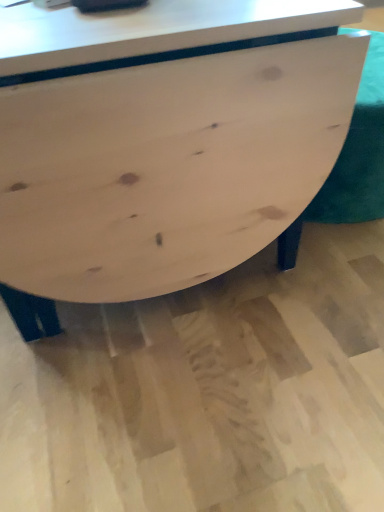
Question: Should I look upward or downward to see natural wood swivel chair at center?

Choices:
 (A) up
 (B) down

Answer: (A)

Question: Is natural wood swivel chair at center in contact with natural wood table at center?

Choices:
 (A) yes
 (B) no

Answer: (B)

Question: Is the depth of natural wood swivel chair at center greater than that of natural wood table at center?

Choices:
 (A) no
 (B) yes

Answer: (B)

Question: Is natural wood table at center at the back of natural wood swivel chair at center?

Choices:
 (A) yes
 (B) no

Answer: (B)

Question: Does natural wood swivel chair at center have a greater height compared to natural wood table at center?

Choices:
 (A) yes
 (B) no

Answer: (B)

Question: From a real-world perspective, is natural wood swivel chair at center positioned over natural wood table at center based on gravity?

Choices:
 (A) no
 (B) yes

Answer: (A)

Question: Considering the relative sizes of natural wood swivel chair at center and natural wood table at center in the image provided, is natural wood swivel chair at center thinner than natural wood table at center?

Choices:
 (A) no
 (B) yes

Answer: (B)

Question: Is natural wood table at center looking in the opposite direction of natural wood swivel chair at center?

Choices:
 (A) no
 (B) yes

Answer: (A)

Question: Could you tell me if natural wood table at center is turned towards natural wood swivel chair at center?

Choices:
 (A) no
 (B) yes

Answer: (A)

Question: From a real-world perspective, is natural wood table at center on natural wood swivel chair at center?

Choices:
 (A) no
 (B) yes

Answer: (B)

Question: Could natural wood swivel chair at center be considered to be inside natural wood table at center?

Choices:
 (A) yes
 (B) no

Answer: (B)

Question: Is natural wood table at center not inside natural wood swivel chair at center?

Choices:
 (A) no
 (B) yes

Answer: (B)

Question: Is natural wood table at center further to the viewer compared to natural wood swivel chair at center?

Choices:
 (A) no
 (B) yes

Answer: (A)

Question: In terms of height, does natural wood table at center look taller or shorter compared to natural wood swivel chair at center?

Choices:
 (A) short
 (B) tall

Answer: (B)